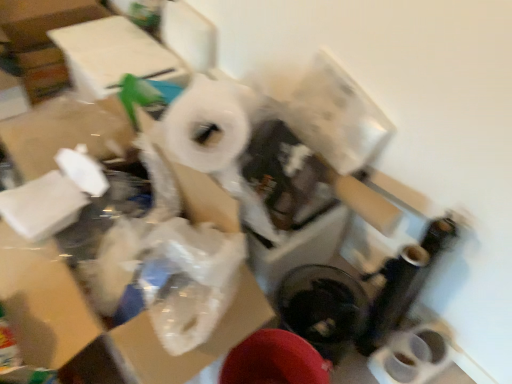
Find the location of a particular element. The image size is (512, 384). white matte toilet paper at lower left is located at coordinates (42, 206).

The width and height of the screenshot is (512, 384). What do you see at coordinates (42, 206) in the screenshot? I see `white matte toilet paper at lower left` at bounding box center [42, 206].

Find the location of a particular element. white matte toilet paper at lower left is located at coordinates (42, 206).